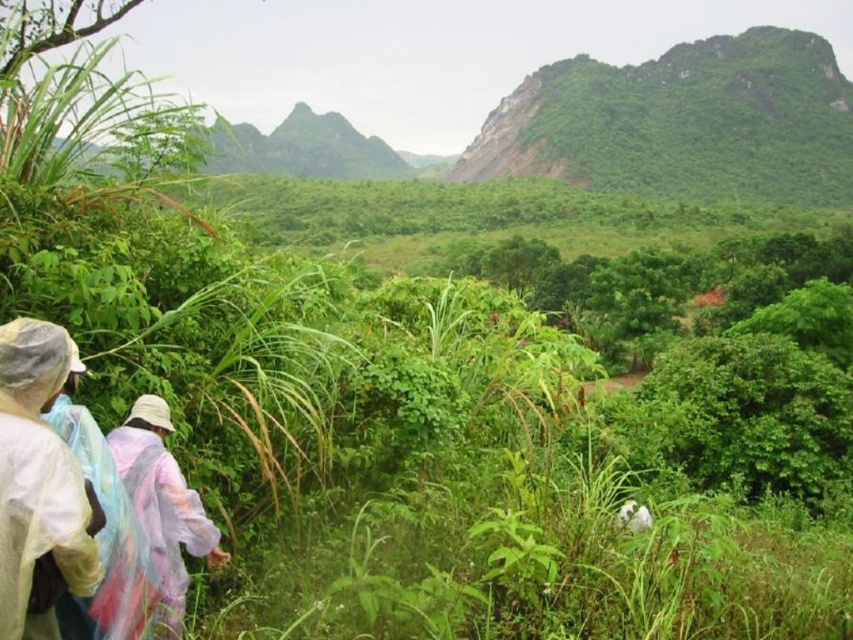
You are a hiker trying to choose between two raincoats at the lower left of your view. The transparent plastic raincoat at lower left and the raincoat fabric at lower left. Which one is narrower?

The transparent plastic raincoat at lower left is narrower than the raincoat fabric at lower left.

You are a hiker who wants to check the condition of your raincoat. You see the transparent plastic raincoat at lower left and the raincoat fabric at lower left. Which one is positioned higher?

The transparent plastic raincoat at lower left is located above the raincoat fabric at lower left, so it is positioned higher.